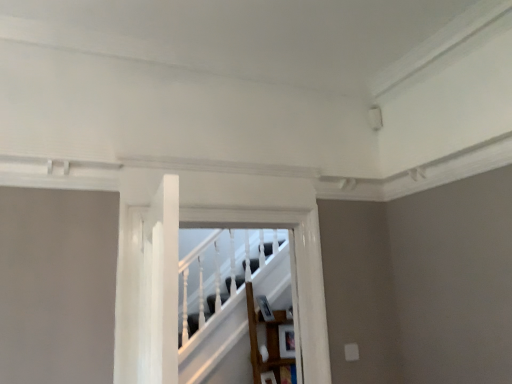
What is the approximate width of wooden bookshelf at center?

wooden bookshelf at center is 16.60 inches wide.

What do you see at coordinates (266, 339) in the screenshot? The width and height of the screenshot is (512, 384). I see `wooden bookshelf at center` at bounding box center [266, 339].

Where is `wooden bookshelf at center`? This screenshot has height=384, width=512. wooden bookshelf at center is located at coordinates (266, 339).

The image size is (512, 384). In order to click on wooden bookshelf at center in this screenshot , I will do `click(266, 339)`.